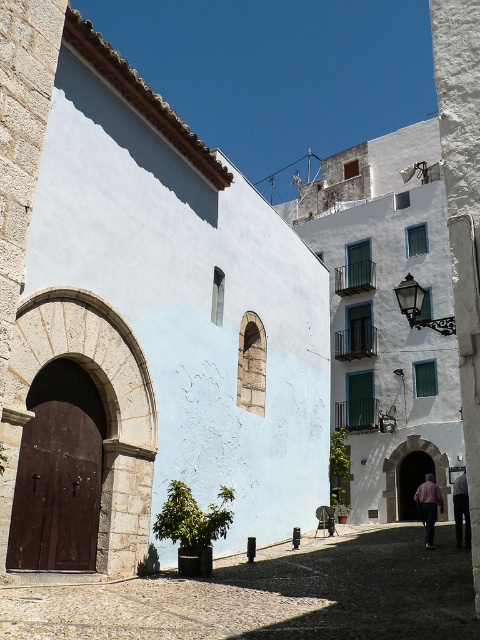
Who is shorter, smooth stone courtyard at center or pink fabric shirt at lower right?

With less height is smooth stone courtyard at center.

Is the position of smooth stone courtyard at center more distant than that of pink fabric shirt at lower right?

No, it is in front of pink fabric shirt at lower right.

The image size is (480, 640). Identify the location of smooth stone courtyard at center. (273, 595).

The width and height of the screenshot is (480, 640). I want to click on smooth stone courtyard at center, so click(x=273, y=595).

Which is above, smooth stone archway at center or pink fabric shirt at lower right?

pink fabric shirt at lower right is higher up.

Does smooth stone archway at center have a larger size compared to pink fabric shirt at lower right?

Incorrect, smooth stone archway at center is not larger than pink fabric shirt at lower right.

Does point (385, 472) lie in front of point (423, 522)?

No, it is behind (423, 522).

Identify the location of smooth stone archway at center. (410, 474).

Looking at this image, does smooth stone archway at center have a smaller size compared to pink fabric at lower right?

Yes, smooth stone archway at center is smaller than pink fabric at lower right.

Can you confirm if smooth stone archway at center is positioned below pink fabric at lower right?

Indeed, smooth stone archway at center is positioned under pink fabric at lower right.

Is point (403, 509) more distant than point (459, 504)?

That is True.

The width and height of the screenshot is (480, 640). In order to click on smooth stone archway at center in this screenshot , I will do `click(410, 474)`.